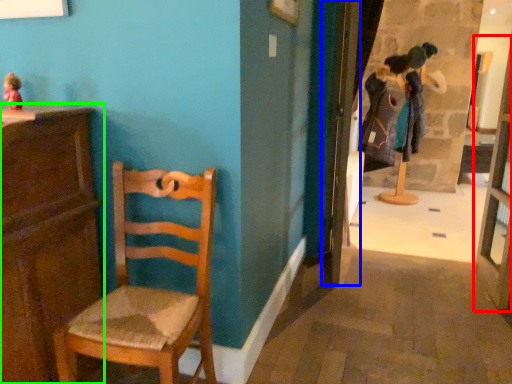
Question: Which object is positioned farthest from glass door (highlighted by a red box)? Select from door (highlighted by a blue box) and cabinetry (highlighted by a green box).

Choices:
 (A) door
 (B) cabinetry

Answer: (B)